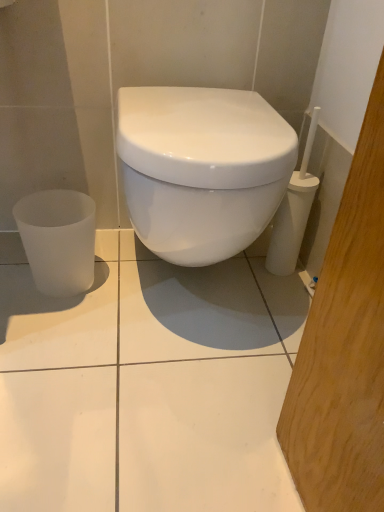
Question: Is white glossy toilet at center placed right next to frosted glass cup at lower left?

Choices:
 (A) no
 (B) yes

Answer: (A)

Question: From the image's perspective, would you say white glossy toilet at center is shown under frosted glass cup at lower left?

Choices:
 (A) yes
 (B) no

Answer: (B)

Question: Would you say frosted glass cup at lower left is part of white glossy toilet at center's contents?

Choices:
 (A) yes
 (B) no

Answer: (B)

Question: From a real-world perspective, is white glossy toilet at center physically below frosted glass cup at lower left?

Choices:
 (A) no
 (B) yes

Answer: (A)

Question: From the image's perspective, is white glossy toilet at center over frosted glass cup at lower left?

Choices:
 (A) yes
 (B) no

Answer: (A)

Question: Does white glossy toilet at center have a smaller size compared to frosted glass cup at lower left?

Choices:
 (A) no
 (B) yes

Answer: (A)

Question: Does frosted glass cup at lower left have a greater height compared to white glossy toilet at center?

Choices:
 (A) no
 (B) yes

Answer: (A)

Question: Is frosted glass cup at lower left closer to the viewer compared to white glossy toilet at center?

Choices:
 (A) no
 (B) yes

Answer: (A)

Question: Is frosted glass cup at lower left completely or partially outside of white glossy toilet at center?

Choices:
 (A) no
 (B) yes

Answer: (B)

Question: From a real-world perspective, is frosted glass cup at lower left located higher than white glossy toilet at center?

Choices:
 (A) no
 (B) yes

Answer: (A)

Question: Is frosted glass cup at lower left not close to white glossy toilet at center?

Choices:
 (A) no
 (B) yes

Answer: (A)

Question: From the image's perspective, is frosted glass cup at lower left on top of white glossy toilet at center?

Choices:
 (A) no
 (B) yes

Answer: (A)

Question: Is white glossy toilet at center wider or thinner than frosted glass cup at lower left?

Choices:
 (A) thin
 (B) wide

Answer: (B)